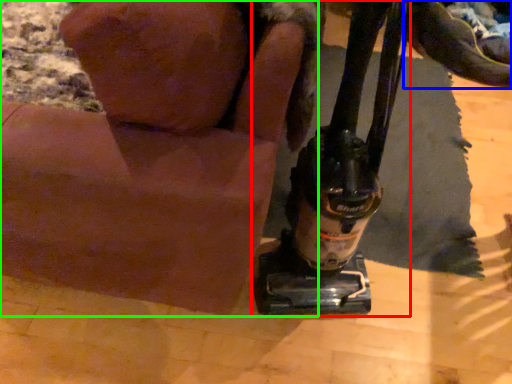
Question: Which is farther away from sewing machine (highlighted by a red box)? footwear (highlighted by a blue box) or animal (highlighted by a green box)?

Choices:
 (A) footwear
 (B) animal

Answer: (A)